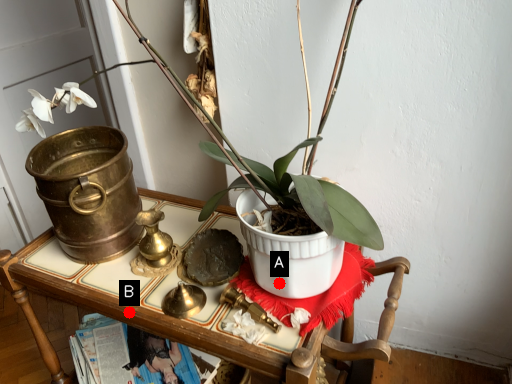
Question: Two points are circled on the image, labeled by A and B beside each circle. Which point is closer to the camera taking this photo?

Choices:
 (A) A is closer
 (B) B is closer

Answer: (A)